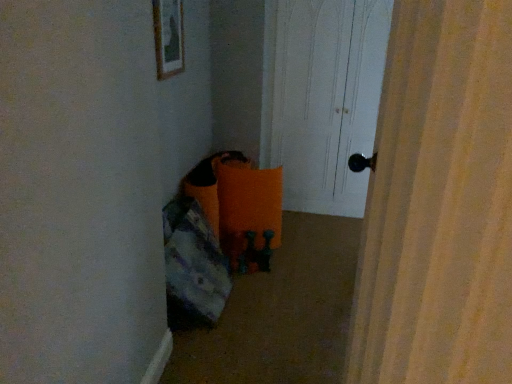
Question: Is matte wooden picture frame at upper center further to camera compared to white wood door at center?

Choices:
 (A) yes
 (B) no

Answer: (B)

Question: Considering the relative sizes of matte wooden picture frame at upper center and white wood door at center in the image provided, is matte wooden picture frame at upper center wider than white wood door at center?

Choices:
 (A) no
 (B) yes

Answer: (A)

Question: Is matte wooden picture frame at upper center positioned in front of white wood door at center?

Choices:
 (A) no
 (B) yes

Answer: (B)

Question: Considering the relative sizes of matte wooden picture frame at upper center and white wood door at center in the image provided, is matte wooden picture frame at upper center smaller than white wood door at center?

Choices:
 (A) no
 (B) yes

Answer: (B)

Question: Can you confirm if matte wooden picture frame at upper center is taller than white wood door at center?

Choices:
 (A) yes
 (B) no

Answer: (B)

Question: Considering the relative sizes of matte wooden picture frame at upper center and white wood door at center in the image provided, is matte wooden picture frame at upper center bigger than white wood door at center?

Choices:
 (A) yes
 (B) no

Answer: (B)

Question: Is white wood door at center far from orange fabric bean bag at lower left?

Choices:
 (A) yes
 (B) no

Answer: (A)

Question: Is white wood door at center oriented away from orange fabric bean bag at lower left?

Choices:
 (A) no
 (B) yes

Answer: (A)

Question: Can you confirm if white wood door at center is wider than orange fabric bean bag at lower left?

Choices:
 (A) no
 (B) yes

Answer: (B)

Question: From a real-world perspective, is white wood door at center below orange fabric bean bag at lower left?

Choices:
 (A) no
 (B) yes

Answer: (A)

Question: Can you confirm if white wood door at center is shorter than orange fabric bean bag at lower left?

Choices:
 (A) yes
 (B) no

Answer: (B)

Question: From a real-world perspective, is white wood door at center on orange fabric bean bag at lower left?

Choices:
 (A) yes
 (B) no

Answer: (A)

Question: From a real-world perspective, is matte wooden picture frame at upper center located beneath orange fabric bean bag at lower left?

Choices:
 (A) no
 (B) yes

Answer: (A)